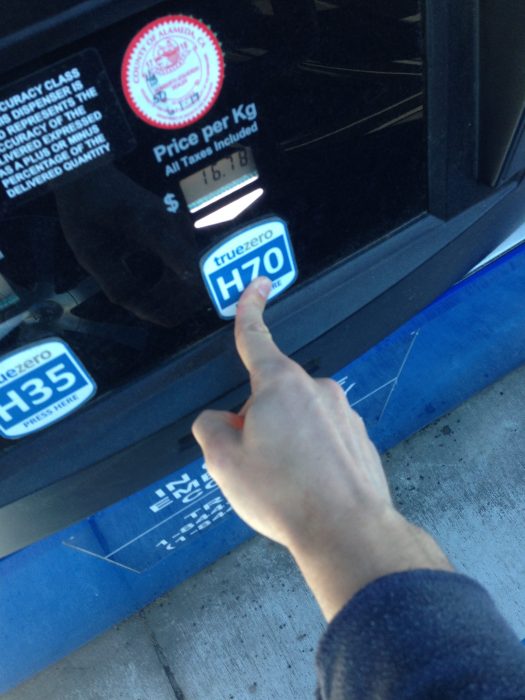
This screenshot has width=525, height=700. Find the location of `digital screen`. digital screen is located at coordinates (200, 180).